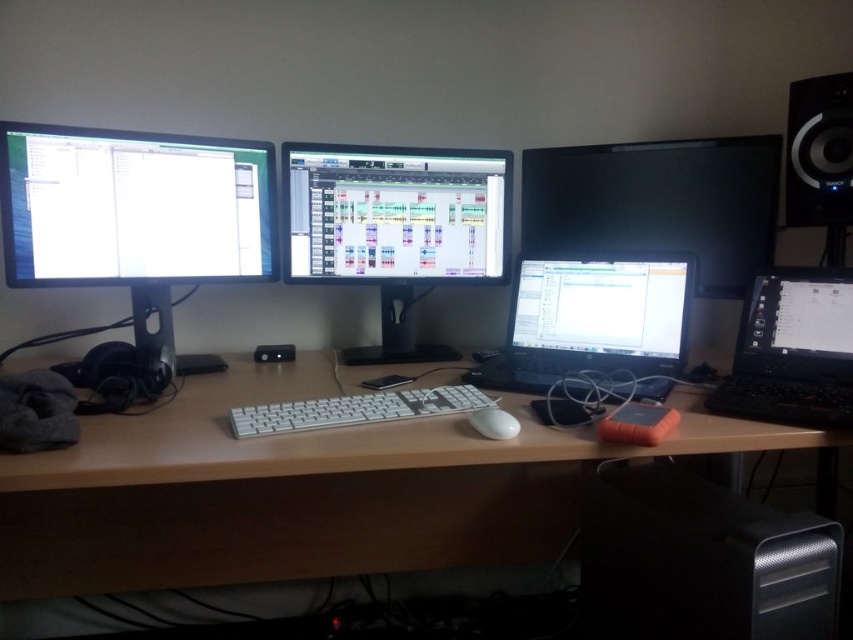
Is black glossy monitor at upper right thinner than white aluminum keyboard at center?

In fact, black glossy monitor at upper right might be wider than white aluminum keyboard at center.

Does point (746, 161) lie in front of point (248, 428)?

No, it is not.

Where is `black glossy monitor at upper right`? black glossy monitor at upper right is located at coordinates (659, 204).

Between point (527, 305) and point (358, 401), which one is positioned in front?

Positioned in front is point (358, 401).

In the scene shown: Who is shorter, black glossy laptop at center or white aluminum keyboard at center?

white aluminum keyboard at center

Does point (653, 330) come farther from viewer compared to point (463, 392)?

Yes, point (653, 330) is farther from viewer.

The height and width of the screenshot is (640, 853). Identify the location of black glossy laptop at center. (592, 320).

Does white wood computer desk at center lie behind black matte laptop at right?

Yes, it is behind black matte laptop at right.

Does white wood computer desk at center have a lesser height compared to black matte laptop at right?

Yes.

The height and width of the screenshot is (640, 853). Find the location of `white wood computer desk at center`. white wood computer desk at center is located at coordinates (308, 488).

The width and height of the screenshot is (853, 640). What are the coordinates of `white wood computer desk at center` in the screenshot? It's located at (308, 488).